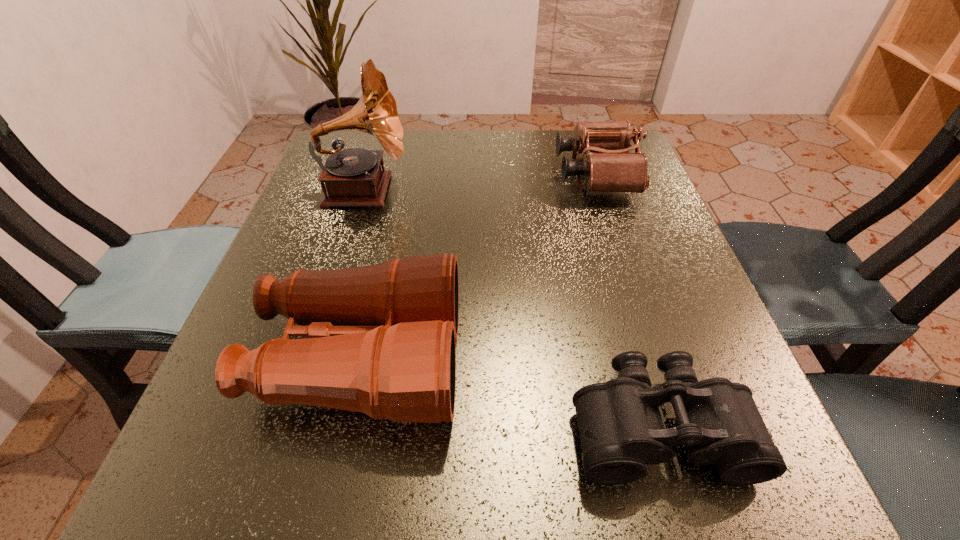
You are a GUI agent. You are given a task and a screenshot of the screen. Output one action in this format:
    pyautogui.click(x=<x>, y=<y>)
    Task: Click on the free space that is in between the third tallest object and the phonograph_record
    Image resolution: width=960 pixels, height=540 pixels.
    Given the screenshot: What is the action you would take?
    pyautogui.click(x=480, y=182)

Identify the location of blank region between the shortest binoculars and the phonograph_record. This screenshot has height=540, width=960. (512, 308).

Where is `free spot between the phonograph_record and the shortest binoculars`? Image resolution: width=960 pixels, height=540 pixels. free spot between the phonograph_record and the shortest binoculars is located at coordinates (512, 308).

At what (x,y) coordinates should I click in order to perform the action: click on free space between the phonograph_record and the shortest binoculars. Please return your answer as a coordinate pair (x, y). This screenshot has height=540, width=960. Looking at the image, I should click on (512, 308).

Identify the location of object that is the third closest one to the leftmost binoculars. The width and height of the screenshot is (960, 540). (608, 166).

The height and width of the screenshot is (540, 960). In order to click on object that is the second closest to the phonograph_record in this screenshot , I will do `click(608, 166)`.

Locate which binoculars is the closest to the tallest binoculars. Please provide its 2D coordinates. Your answer should be formatted as a tuple, i.e. [(x, y)], where the tuple contains the x and y coordinates of a point satisfying the conditions above.

[(621, 431)]

Identify which binoculars is located as the second nearest to the leftmost binoculars. Please provide its 2D coordinates. Your answer should be formatted as a tuple, i.e. [(x, y)], where the tuple contains the x and y coordinates of a point satisfying the conditions above.

[(608, 166)]

Locate an element on the screen. This screenshot has height=540, width=960. blank space that satisfies the following two spatial constraints: 1. through the eyepieces of the second shortest object; 2. at the eyepieces of the shortest binoculars is located at coordinates (679, 427).